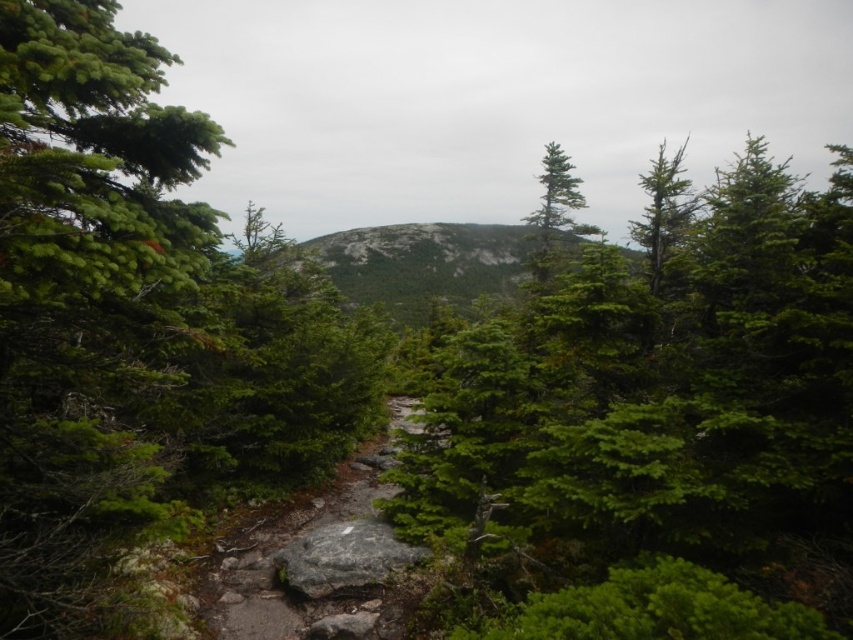
Question: Which point appears closest to the camera in this image?

Choices:
 (A) (120, 81)
 (B) (326, 573)
 (C) (762, 195)

Answer: (A)

Question: Which object appears closest to the camera in this image?

Choices:
 (A) gray rough rock at center
 (B) green textured rock at center

Answer: (A)

Question: Which point is closer to the camera?

Choices:
 (A) (381, 237)
 (B) (412, 552)
 (C) (277, 573)

Answer: (B)

Question: In this image, where is green matte tree at center located relative to green textured rock at center?

Choices:
 (A) below
 (B) above

Answer: (B)

Question: Is green needle-like at left to the left of dull gray stone path at center from the viewer's perspective?

Choices:
 (A) no
 (B) yes

Answer: (B)

Question: Is green textured rock at center positioned behind gray rough rock at center?

Choices:
 (A) no
 (B) yes

Answer: (B)